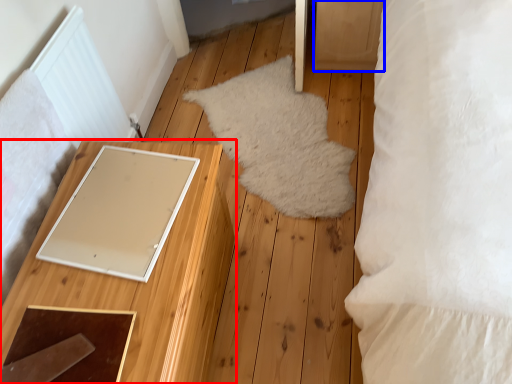
Question: Which object is further to the camera taking this photo, furniture (highlighted by a red box) or drawer (highlighted by a blue box)?

Choices:
 (A) furniture
 (B) drawer

Answer: (B)